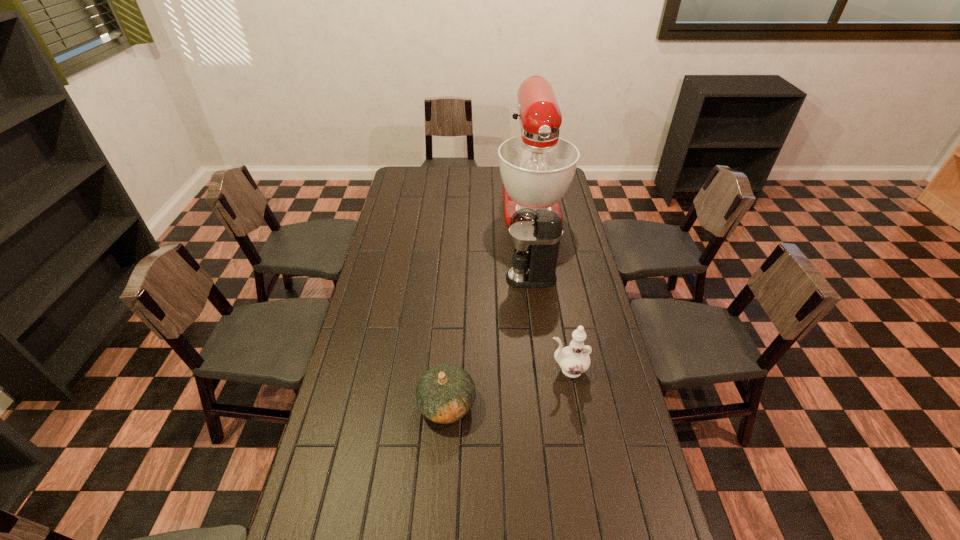
Image resolution: width=960 pixels, height=540 pixels. I want to click on object that is the third closest to the chinaware, so point(537,168).

The height and width of the screenshot is (540, 960). Find the location of `vacant point that satisfies the following two spatial constraints: 1. at the attachment hub of the farthest object; 2. place cup under the spout of the third shortest object`. vacant point that satisfies the following two spatial constraints: 1. at the attachment hub of the farthest object; 2. place cup under the spout of the third shortest object is located at coordinates (542, 278).

Where is `free space that satisfies the following two spatial constraints: 1. at the attachment hub of the mixer; 2. place cup under the spout of the coffee maker`? Image resolution: width=960 pixels, height=540 pixels. free space that satisfies the following two spatial constraints: 1. at the attachment hub of the mixer; 2. place cup under the spout of the coffee maker is located at coordinates (542, 278).

What are the coordinates of `vacant region that satisfies the following two spatial constraints: 1. at the attachment hub of the mixer; 2. place cup under the spout of the coffee maker` in the screenshot? It's located at (542, 278).